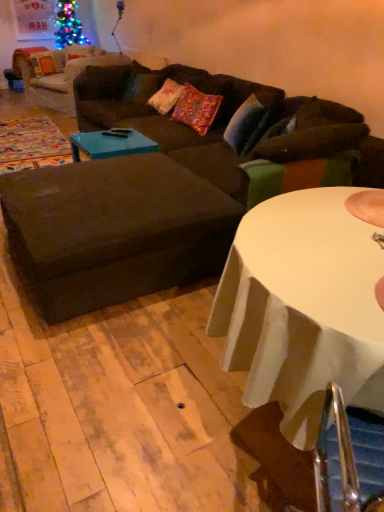
Question: Are floral fabric pillow at center and brown fabric ottoman at center far apart?

Choices:
 (A) yes
 (B) no

Answer: (A)

Question: Is brown fabric ottoman at center at the back of floral fabric pillow at center?

Choices:
 (A) no
 (B) yes

Answer: (A)

Question: From a real-world perspective, is floral fabric pillow at center located higher than brown fabric ottoman at center?

Choices:
 (A) yes
 (B) no

Answer: (A)

Question: Is floral fabric pillow at center positioned behind brown fabric ottoman at center?

Choices:
 (A) no
 (B) yes

Answer: (B)

Question: From the image's perspective, is floral fabric pillow at center under brown fabric ottoman at center?

Choices:
 (A) no
 (B) yes

Answer: (A)

Question: Is floral fabric pillow at center at the right side of brown fabric ottoman at center?

Choices:
 (A) yes
 (B) no

Answer: (A)

Question: Considering the relative sizes of blue glossy coffee table at center and floral fabric pillow at center in the image provided, is blue glossy coffee table at center thinner than floral fabric pillow at center?

Choices:
 (A) no
 (B) yes

Answer: (A)

Question: From the image's perspective, would you say blue glossy coffee table at center is shown under floral fabric pillow at center?

Choices:
 (A) yes
 (B) no

Answer: (A)

Question: Is blue glossy coffee table at center aimed at floral fabric pillow at center?

Choices:
 (A) yes
 (B) no

Answer: (B)

Question: Is blue glossy coffee table at center turned away from floral fabric pillow at center?

Choices:
 (A) no
 (B) yes

Answer: (B)

Question: From a real-world perspective, does blue glossy coffee table at center sit lower than floral fabric pillow at center?

Choices:
 (A) no
 (B) yes

Answer: (B)

Question: Considering the relative sizes of blue glossy coffee table at center and floral fabric pillow at center in the image provided, is blue glossy coffee table at center shorter than floral fabric pillow at center?

Choices:
 (A) no
 (B) yes

Answer: (B)

Question: From the image's perspective, is blue glossy coffee table at center on dark brown fabric couch at center?

Choices:
 (A) yes
 (B) no

Answer: (B)